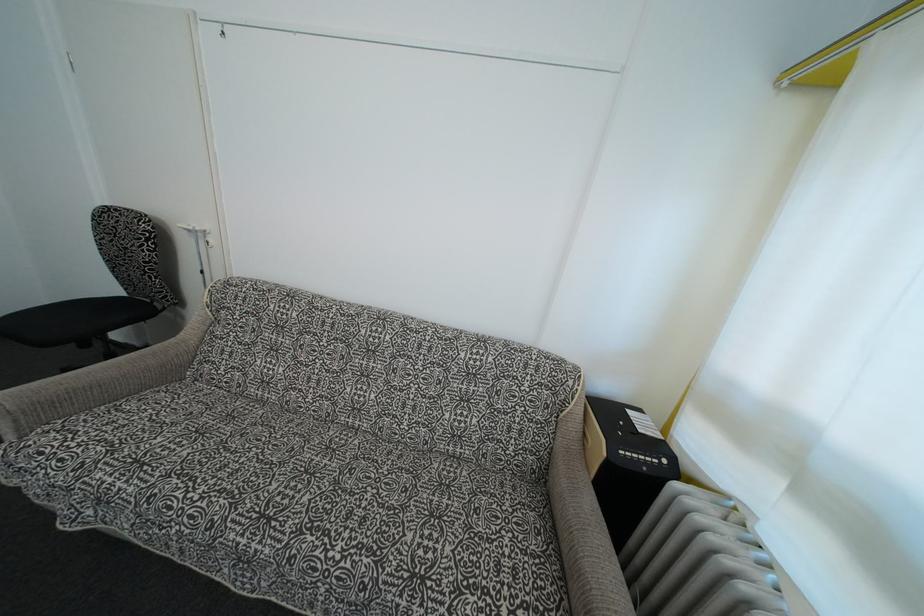
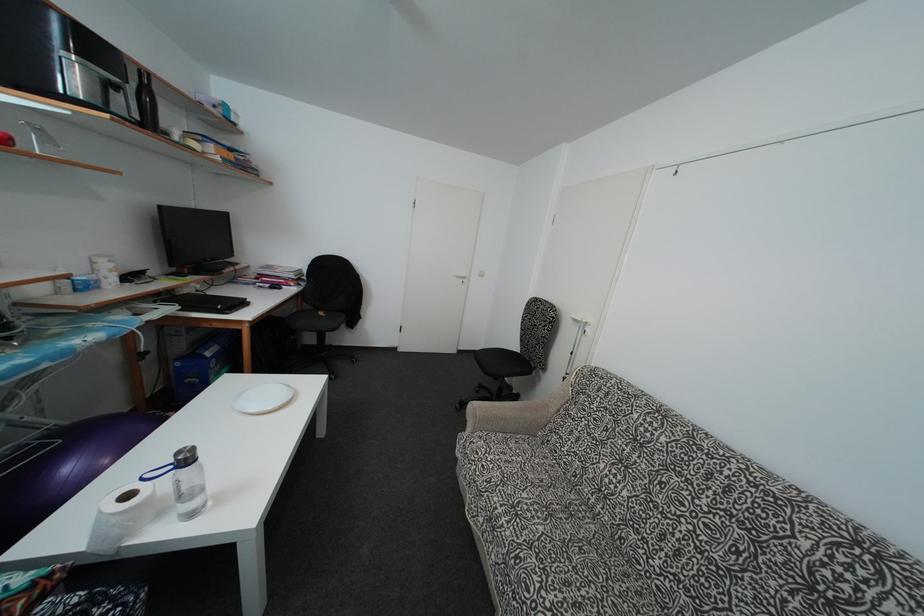
Locate, in the second image, the point that corresponds to (x=175, y=515) in the first image.

(532, 598)